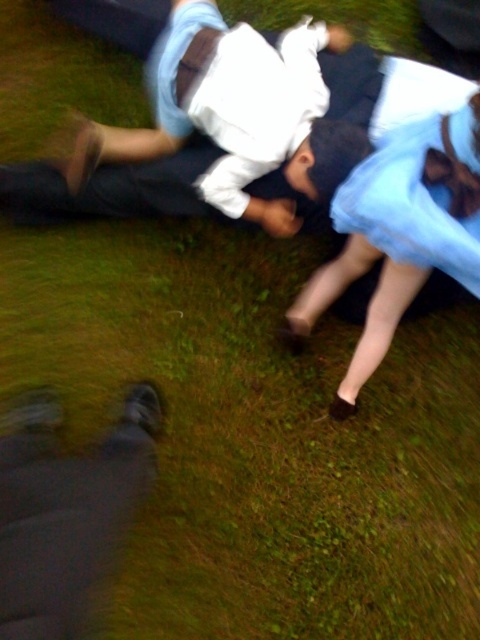
Question: Does light blue satin dress at center have a smaller size compared to light blue satin dress at upper right?

Choices:
 (A) yes
 (B) no

Answer: (B)

Question: Among these objects, which one is nearest to the camera?

Choices:
 (A) light blue satin dress at upper right
 (B) dark gray pants at lower left

Answer: (B)

Question: Which object appears farthest from the camera in this image?

Choices:
 (A) light blue satin dress at center
 (B) dark gray pants at lower left
 (C) light blue satin dress at upper right

Answer: (C)

Question: Can you confirm if light blue satin dress at center is positioned below light blue satin dress at upper right?

Choices:
 (A) yes
 (B) no

Answer: (A)

Question: Among these objects, which one is nearest to the camera?

Choices:
 (A) dark gray pants at lower left
 (B) light blue satin dress at center

Answer: (A)

Question: Is light blue satin dress at center bigger than light blue satin dress at upper right?

Choices:
 (A) no
 (B) yes

Answer: (B)